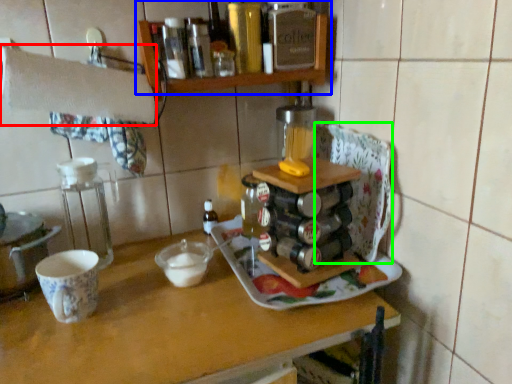
Question: Estimate the real-world distances between objects in this image. Which object is closer to towel bar (highlighted by a red box), shelf (highlighted by a blue box) or wide (highlighted by a green box)?

Choices:
 (A) shelf
 (B) wide

Answer: (A)